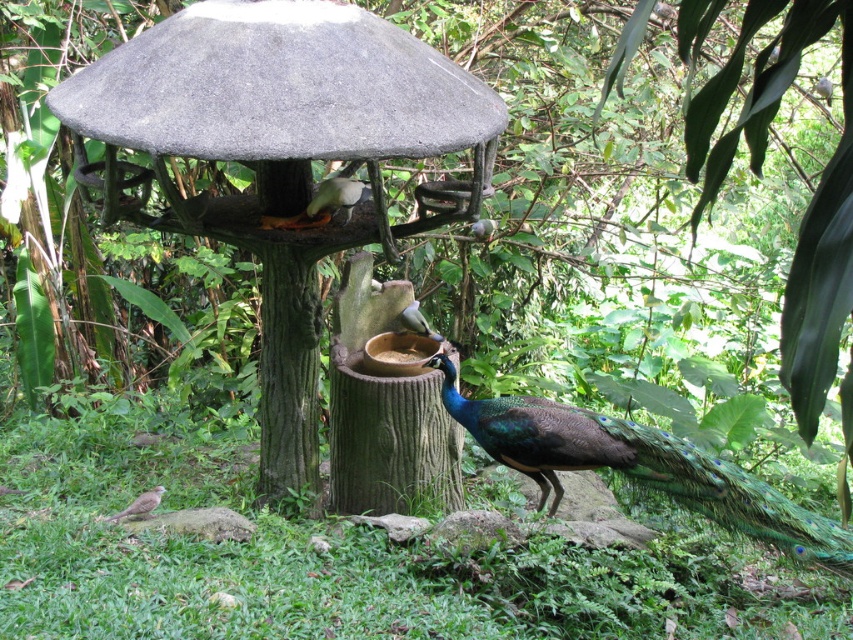
Does point (814, 522) lie behind point (334, 211)?

No, (814, 522) is closer to viewer.

Which is in front, point (683, 500) or point (335, 184)?

Point (683, 500) is in front.

I want to click on green glossy peacock at lower right, so click(640, 467).

Between point (744, 483) and point (126, 506), which one is positioned behind?

The point (126, 506) is more distant.

Does point (560, 406) come farther from viewer compared to point (128, 513)?

Yes, it is.

This screenshot has width=853, height=640. In order to click on green glossy peacock at lower right in this screenshot , I will do `click(640, 467)`.

Does point (157, 502) come behind point (418, 330)?

No, it is in front of (418, 330).

Is brown speckled bird at lower left below white matte bowl at center?

Indeed, brown speckled bird at lower left is positioned under white matte bowl at center.

I want to click on brown speckled bird at lower left, so click(x=140, y=506).